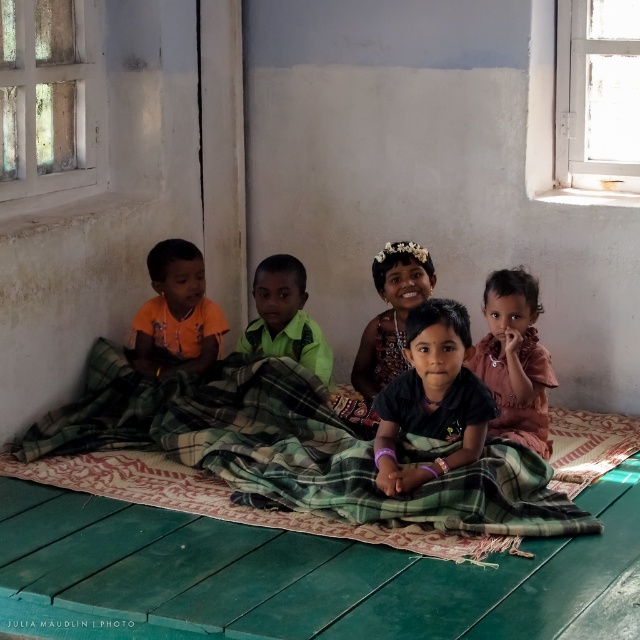
You are a parent trying to decide which fabric to use for a child safety helmet. You see the dark green fabric at center and the black fabric tiara at center. Which one is taller?

The dark green fabric at center is taller than the black fabric tiara at center.

You are a tailor who needs to determine which fabric has a larger width between the dark green fabric at center and the black fabric tiara at center. Which one should you choose?

The dark green fabric at center has a larger width than the black fabric tiara at center, so you should choose the dark green fabric at center.

You are a photographer setting up a shoot in the room. You need to ensure that the orange matte shirt at left and the black fabric tiara at center are both visible in the frame. Given their height difference, which object might require you to adjust your camera angle to capture it properly?

The orange matte shirt at left is much taller than the black fabric tiara at center, so you might need to lower your camera angle to ensure the taller orange matte shirt at left is fully visible without blocking the smaller black fabric tiara at center.